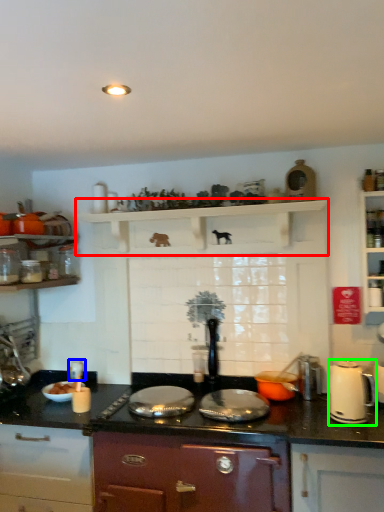
Question: Considering the real-world distances, which object is farthest from shelf (highlighted by a red box)? appliance (highlighted by a blue box) or kitchen appliance (highlighted by a green box)?

Choices:
 (A) appliance
 (B) kitchen appliance

Answer: (A)